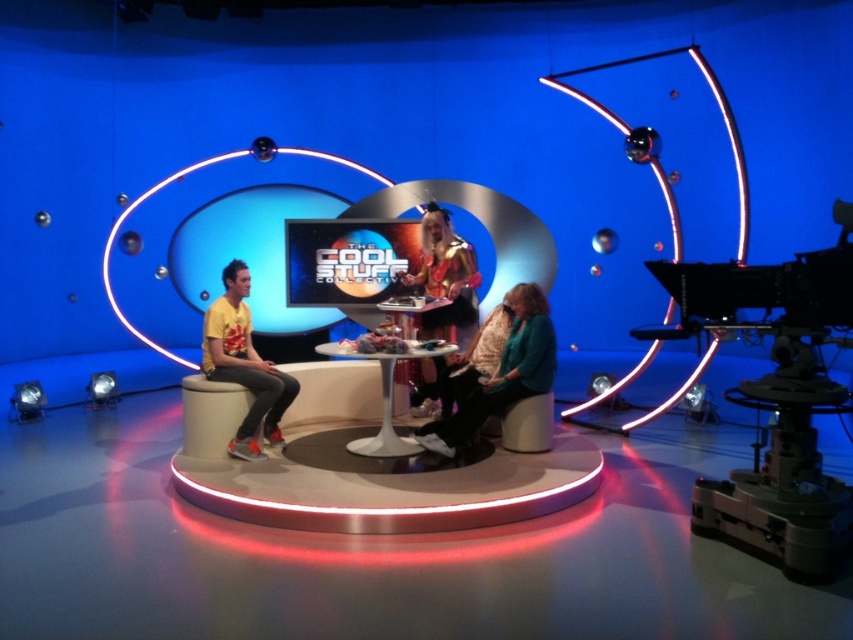
Question: Is yellow printed t-shirt at left bigger than gold metallic costume at center?

Choices:
 (A) yes
 (B) no

Answer: (B)

Question: Which of the following is the farthest from the observer?

Choices:
 (A) click(x=445, y=209)
 (B) click(x=227, y=376)

Answer: (A)

Question: Observing the image, what is the correct spatial positioning of teal fabric jacket at center in reference to gold metallic costume at center?

Choices:
 (A) above
 (B) below

Answer: (B)

Question: Which point is closer to the camera?

Choices:
 (A) (457, 310)
 (B) (523, 291)
 (C) (248, 442)
 (D) (368, 445)

Answer: (C)

Question: Is yellow printed t-shirt at left positioned behind white glossy round table at center?

Choices:
 (A) no
 (B) yes

Answer: (B)

Question: Which object is farther from the camera taking this photo?

Choices:
 (A) yellow printed t-shirt at left
 (B) teal fabric jacket at center
 (C) gold metallic costume at center
 (D) white glossy round table at center

Answer: (C)